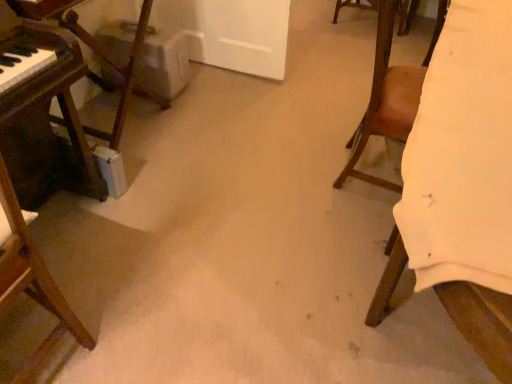
Question: Is wooden piano at left, acting as the 2th furniture starting from the right, facing towards white fabric at right, the first furniture viewed from the right?

Choices:
 (A) no
 (B) yes

Answer: (B)

Question: Considering the relative sizes of wooden piano at left, marked as the 1th furniture in a left-to-right arrangement, and white fabric at right, the 2th furniture from the left, in the image provided, is wooden piano at left, marked as the 1th furniture in a left-to-right arrangement, wider than white fabric at right, the 2th furniture from the left,?

Choices:
 (A) yes
 (B) no

Answer: (B)

Question: Is wooden piano at left, marked as the 1th furniture in a left-to-right arrangement, at the left side of white fabric at right, the 2th furniture from the left?

Choices:
 (A) no
 (B) yes

Answer: (B)

Question: From the image's perspective, is wooden piano at left, marked as the 1th furniture in a left-to-right arrangement, above white fabric at right, the first furniture viewed from the right?

Choices:
 (A) no
 (B) yes

Answer: (B)

Question: From a real-world perspective, is wooden piano at left, marked as the 1th furniture in a left-to-right arrangement, on white fabric at right, the 2th furniture from the left?

Choices:
 (A) no
 (B) yes

Answer: (B)

Question: From their relative heights in the image, would you say wooden piano at left, marked as the 1th furniture in a left-to-right arrangement, is taller or shorter than brown leather chair at right, which is the second chair in left-to-right order?

Choices:
 (A) short
 (B) tall

Answer: (A)

Question: Relative to brown leather chair at right, which is the second chair in left-to-right order, is wooden piano at left, marked as the 1th furniture in a left-to-right arrangement, in front or behind?

Choices:
 (A) front
 (B) behind

Answer: (B)

Question: Looking at the image, does wooden piano at left, acting as the 2th furniture starting from the right, seem bigger or smaller compared to brown leather chair at right, which is the second chair in left-to-right order?

Choices:
 (A) small
 (B) big

Answer: (B)

Question: From the image's perspective, is wooden piano at left, acting as the 2th furniture starting from the right, positioned above or below brown leather chair at right, which is the second chair in left-to-right order?

Choices:
 (A) below
 (B) above

Answer: (B)

Question: From a real-world perspective, is white fabric at right, the first furniture viewed from the right, physically located above or below wooden piano at left, acting as the 2th furniture starting from the right?

Choices:
 (A) below
 (B) above

Answer: (A)

Question: Is white fabric at right, the 2th furniture from the left, spatially inside wooden piano at left, marked as the 1th furniture in a left-to-right arrangement, or outside of it?

Choices:
 (A) outside
 (B) inside

Answer: (A)

Question: Based on their positions, is white fabric at right, the 2th furniture from the left, located to the left or right of wooden piano at left, acting as the 2th furniture starting from the right?

Choices:
 (A) right
 (B) left

Answer: (A)

Question: Considering the positions of white fabric at right, the 2th furniture from the left, and wooden piano at left, acting as the 2th furniture starting from the right, in the image, is white fabric at right, the 2th furniture from the left, bigger or smaller than wooden piano at left, acting as the 2th furniture starting from the right,?

Choices:
 (A) small
 (B) big

Answer: (B)

Question: Considering their positions, is white fabric at right, the 2th furniture from the left, located in front of or behind brown wooden chair at left, the 2th chair from the right?

Choices:
 (A) behind
 (B) front

Answer: (B)

Question: From the image's perspective, is white fabric at right, the first furniture viewed from the right, positioned above or below brown wooden chair at left, the 2th chair from the right?

Choices:
 (A) above
 (B) below

Answer: (A)